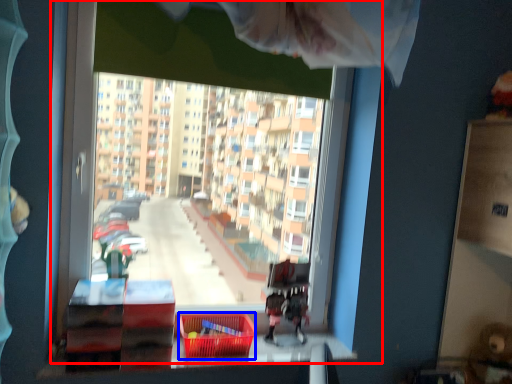
Question: Which point is further to the camera, window (highlighted by a red box) or basket (highlighted by a blue box)?

Choices:
 (A) window
 (B) basket

Answer: (B)